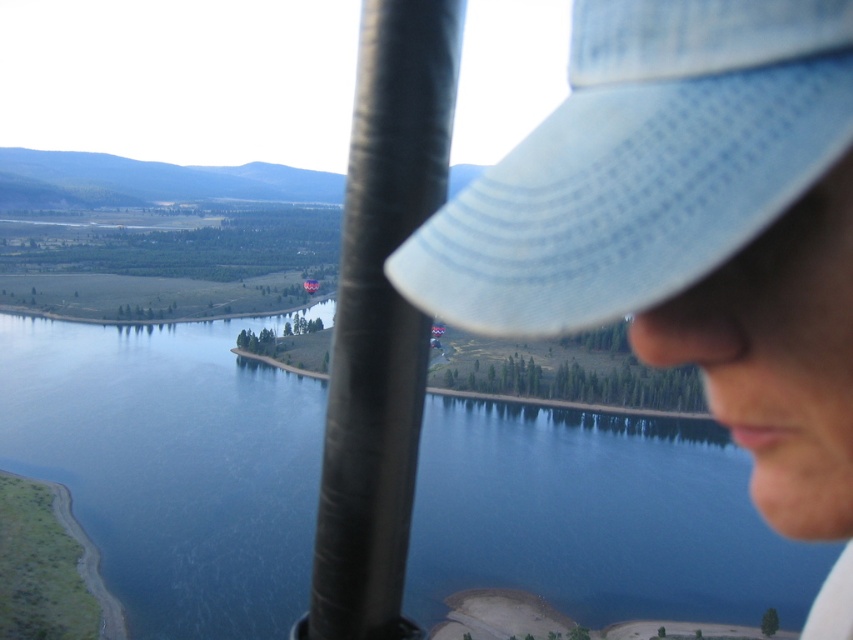
Does point (610, 589) come in front of point (590, 177)?

No.

Is the position of blue water at center less distant than that of light blue woven baseball cap at upper right?

No, blue water at center is behind light blue woven baseball cap at upper right.

Locate an element on the screen. Image resolution: width=853 pixels, height=640 pixels. blue water at center is located at coordinates (172, 467).

Find the location of a particular element. blue water at center is located at coordinates (172, 467).